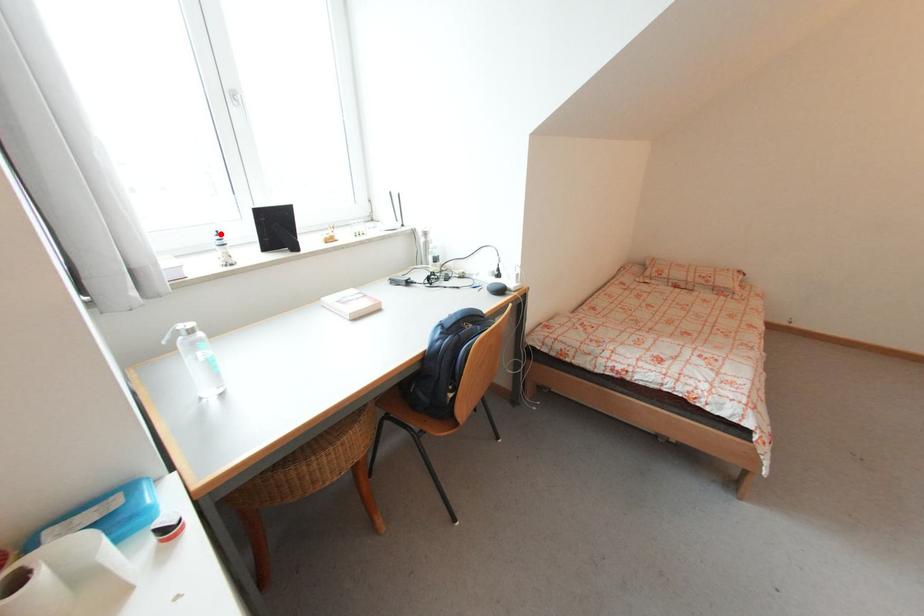
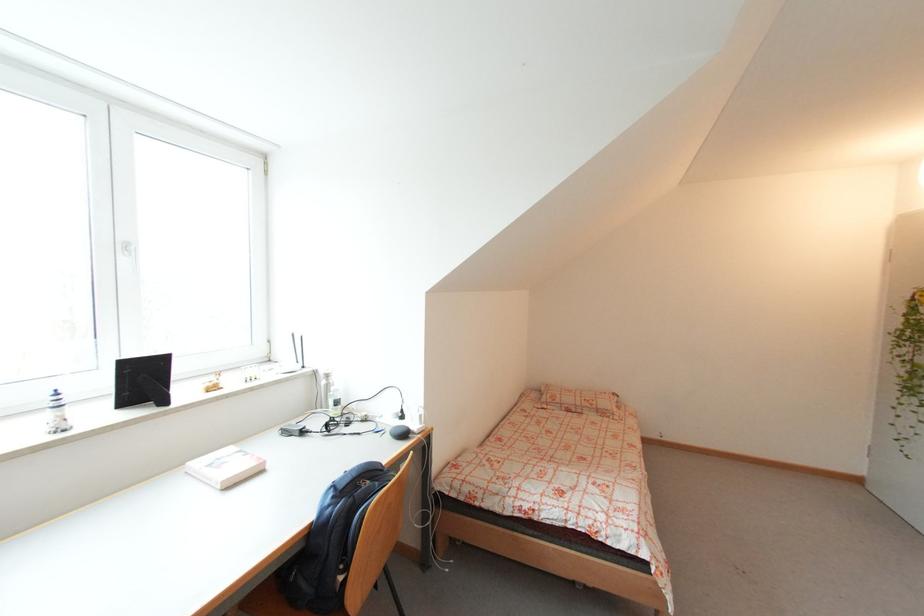
Locate, in the second image, the point that corresponds to the highlighted location in the first image.

(58, 392)